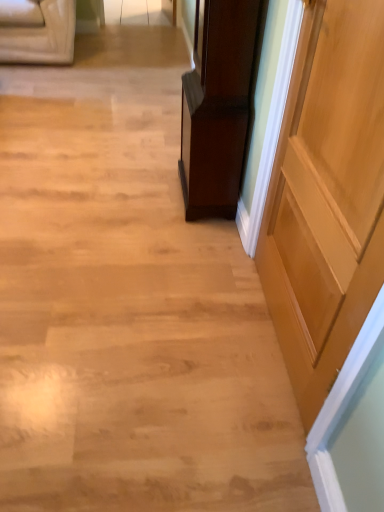
Question: From the image's perspective, is shiny dark wood cabinet at center under light brown wood door at right?

Choices:
 (A) yes
 (B) no

Answer: (B)

Question: Does shiny dark wood cabinet at center come in front of light brown wood door at right?

Choices:
 (A) no
 (B) yes

Answer: (A)

Question: Is light brown wood door at right at the back of shiny dark wood cabinet at center?

Choices:
 (A) no
 (B) yes

Answer: (A)

Question: Can you see shiny dark wood cabinet at center touching light brown wood door at right?

Choices:
 (A) yes
 (B) no

Answer: (B)

Question: Is shiny dark wood cabinet at center located outside light brown wood door at right?

Choices:
 (A) yes
 (B) no

Answer: (A)

Question: Does shiny dark wood cabinet at center have a greater height compared to light brown wood door at right?

Choices:
 (A) no
 (B) yes

Answer: (A)

Question: From a real-world perspective, is light brown wood door at right below shiny dark wood cabinet at center?

Choices:
 (A) no
 (B) yes

Answer: (A)

Question: Is light brown wood door at right next to shiny dark wood cabinet at center?

Choices:
 (A) yes
 (B) no

Answer: (B)

Question: Is light brown wood door at right not near shiny dark wood cabinet at center?

Choices:
 (A) no
 (B) yes

Answer: (A)

Question: Does light brown wood door at right come in front of shiny dark wood cabinet at center?

Choices:
 (A) no
 (B) yes

Answer: (B)

Question: Considering the relative sizes of light brown wood door at right and shiny dark wood cabinet at center in the image provided, is light brown wood door at right taller than shiny dark wood cabinet at center?

Choices:
 (A) no
 (B) yes

Answer: (B)

Question: Does light brown wood door at right have a smaller size compared to shiny dark wood cabinet at center?

Choices:
 (A) yes
 (B) no

Answer: (A)

Question: From their relative heights in the image, would you say light brown wood door at right is taller or shorter than shiny dark wood cabinet at center?

Choices:
 (A) short
 (B) tall

Answer: (B)